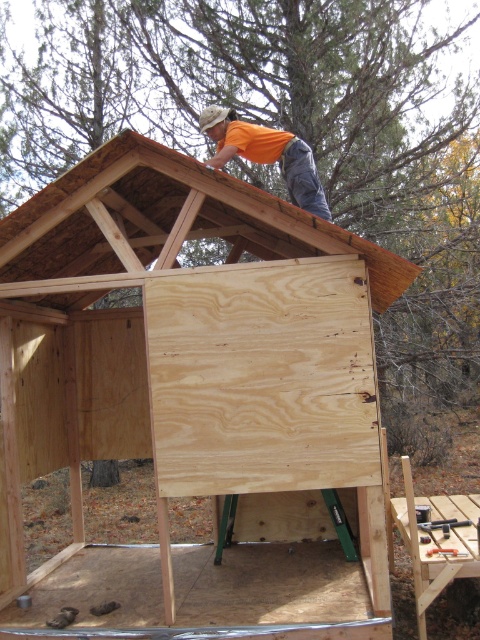
Question: Can you confirm if plywoodwoodenpanel at center is bigger than orange t-shirt at upper center?

Choices:
 (A) no
 (B) yes

Answer: (A)

Question: Which object is farther from the camera taking this photo?

Choices:
 (A) plywood at upper center
 (B) orange t-shirt at upper center
 (C) brown wood at upper center

Answer: (B)

Question: Among these points, which one is farthest from the camera?

Choices:
 (A) (376, 285)
 (B) (199, 444)

Answer: (A)

Question: Can you confirm if plywoodwoodenpanel at center is positioned to the left of orange t-shirt at upper center?

Choices:
 (A) yes
 (B) no

Answer: (B)

Question: Can you confirm if plywood at upper center is positioned to the left of orange t-shirt at upper center?

Choices:
 (A) no
 (B) yes

Answer: (B)

Question: Which point is farther from the camera taking this photo?

Choices:
 (A) click(297, 160)
 (B) click(83, 300)
 (C) click(240, 422)

Answer: (B)